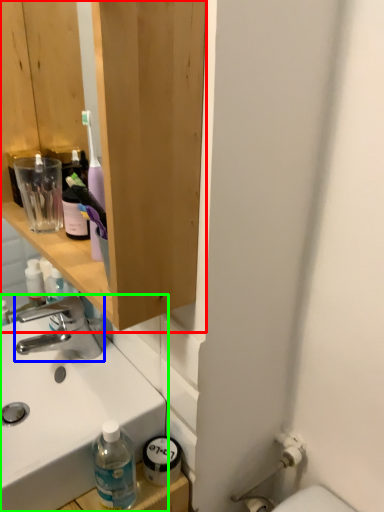
Question: Which object is the farthest from bathroom cabinet (highlighted by a red box)? Choose among these: tap (highlighted by a blue box) or sink (highlighted by a green box).

Choices:
 (A) tap
 (B) sink

Answer: (A)